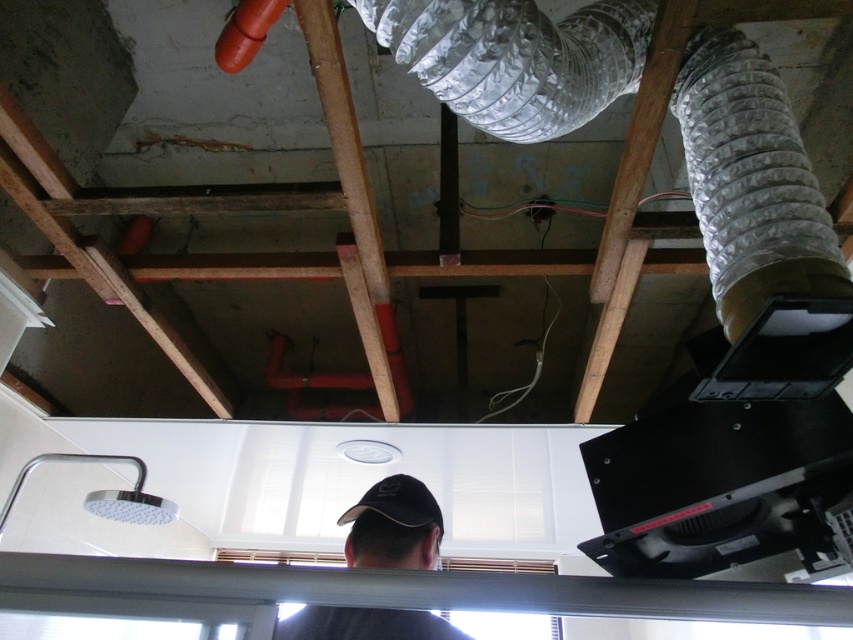
Question: Is brown wooden beam at center thinner than black cap at center?

Choices:
 (A) no
 (B) yes

Answer: (B)

Question: From the image, what is the correct spatial relationship of white plastic beam at lower center in relation to black cap at center?

Choices:
 (A) right
 (B) left

Answer: (A)

Question: Which object is positioned closest to the brown wooden beam at center?

Choices:
 (A) white plastic beam at lower center
 (B) black fabric baseball cap at center
 (C) black cap at center

Answer: (B)

Question: Which point is closer to the camera taking this photo?

Choices:
 (A) (389, 492)
 (B) (361, 195)
 (C) (308, 637)
 (D) (675, 609)

Answer: (D)

Question: Does white plastic beam at lower center have a lesser width compared to black cap at center?

Choices:
 (A) no
 (B) yes

Answer: (A)

Question: Which point is farther from the camera taking this photo?

Choices:
 (A) (508, 600)
 (B) (357, 132)
 (C) (347, 538)
 (D) (355, 504)

Answer: (B)